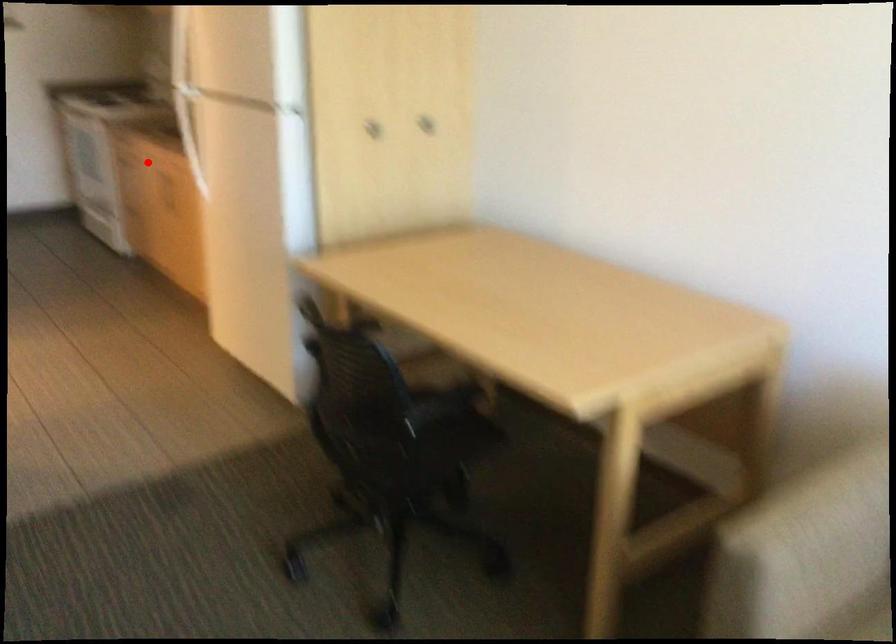
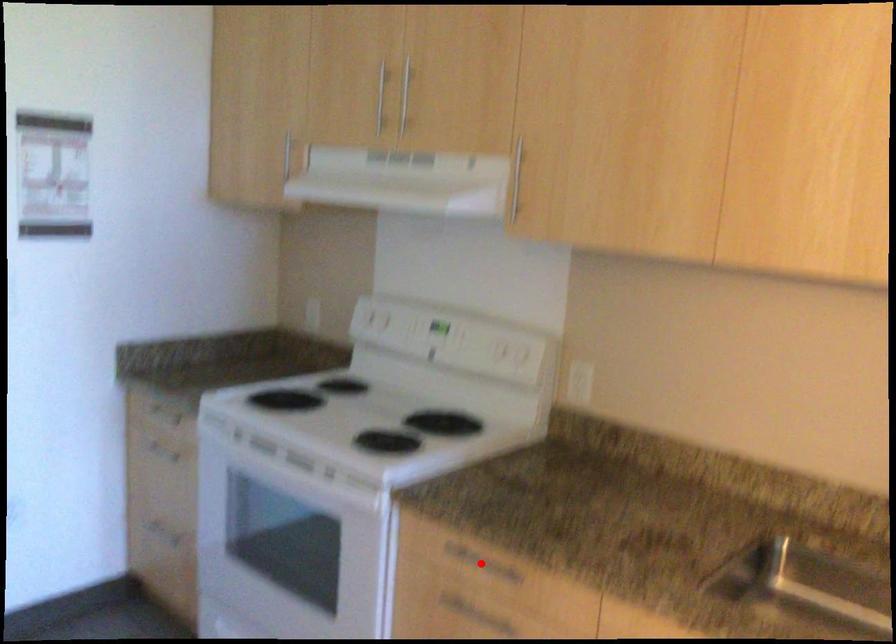
I am providing you with two images of the same scene from different viewpoints. A red point is marked on the first image and another point is marked on the second image. Are the points marked in image1 and image2 representing the same 3D position?

No